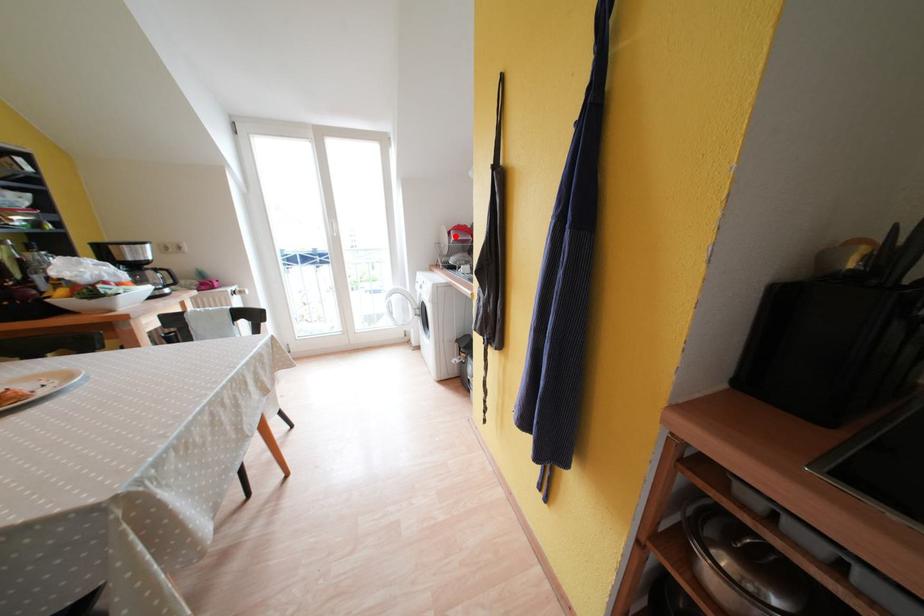
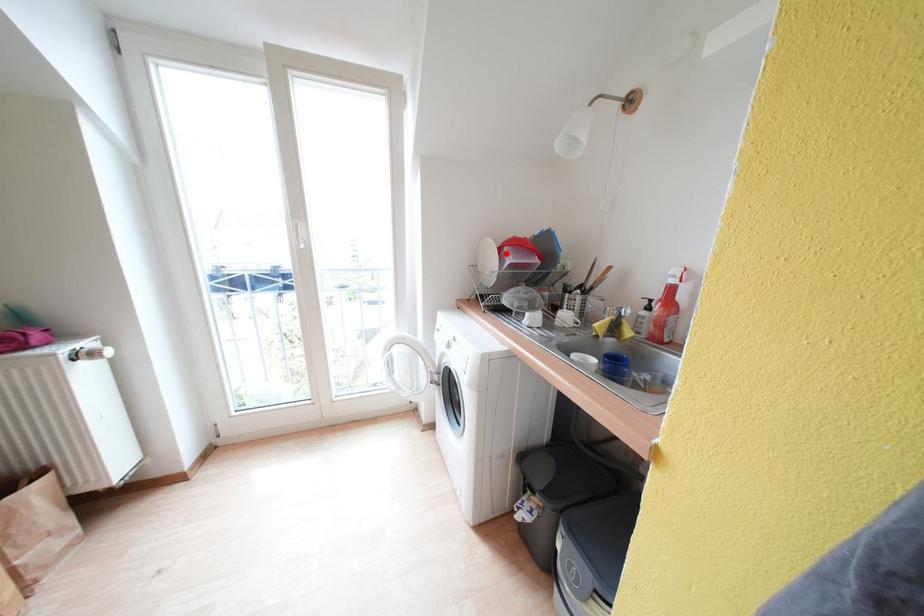
I am providing you with two images of the same scene from different viewpoints. A red point is marked on the first image and another point is marked on the second image. Does the point marked in image1 correspond to the same location as the one in image2?

Yes